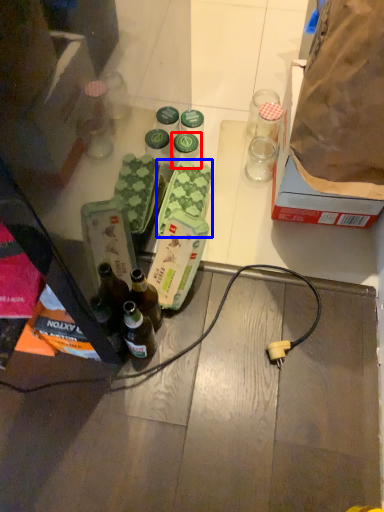
Question: Among these objects, which one is farthest to the camera, bottle (highlighted by a red box) or food (highlighted by a blue box)?

Choices:
 (A) bottle
 (B) food

Answer: (A)